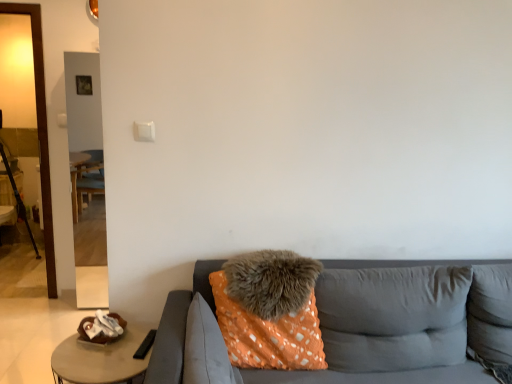
Question: From the image's perspective, would you say orange fabric couch at center is positioned over gray fabric pillow at right, which is counted as the 5th pillow, starting from the left?

Choices:
 (A) no
 (B) yes

Answer: (A)

Question: From a real-world perspective, is orange fabric couch at center under gray fabric pillow at right, the first pillow in the right-to-left sequence?

Choices:
 (A) no
 (B) yes

Answer: (B)

Question: Does orange fabric couch at center have a larger size compared to gray fabric pillow at right, which is counted as the 5th pillow, starting from the left?

Choices:
 (A) no
 (B) yes

Answer: (B)

Question: Is orange fabric couch at center wider than gray fabric pillow at right, which is counted as the 5th pillow, starting from the left?

Choices:
 (A) yes
 (B) no

Answer: (A)

Question: Is orange fabric couch at center not close to gray fabric pillow at right, which is counted as the 5th pillow, starting from the left?

Choices:
 (A) yes
 (B) no

Answer: (A)

Question: Is point (323, 291) closer or farther from the camera than point (245, 316)?

Choices:
 (A) farther
 (B) closer

Answer: (A)

Question: In terms of height, does orange fabric pillow at center, the 4th pillow positioned from the left, look taller or shorter compared to orange fuzzy pillow at center, the 2th pillow when ordered from left to right?

Choices:
 (A) short
 (B) tall

Answer: (A)

Question: In terms of size, does orange fabric pillow at center, the 4th pillow positioned from the left, appear bigger or smaller than orange fuzzy pillow at center, the 2th pillow when ordered from left to right?

Choices:
 (A) big
 (B) small

Answer: (B)

Question: From a real-world perspective, relative to orange fuzzy pillow at center, the 2th pillow when ordered from left to right, is orange fabric pillow at center, the 4th pillow positioned from the left, vertically above or below?

Choices:
 (A) below
 (B) above

Answer: (B)

Question: From the image's perspective, relative to orange fabric couch at center, is orange fuzzy pillow at center, the 2th pillow when ordered from left to right, above or below?

Choices:
 (A) below
 (B) above

Answer: (B)

Question: From a real-world perspective, is orange fuzzy pillow at center, placed as the fourth pillow when sorted from right to left, physically located above or below orange fabric couch at center?

Choices:
 (A) above
 (B) below

Answer: (A)

Question: Is orange fuzzy pillow at center, the 2th pillow when ordered from left to right, inside the boundaries of orange fabric couch at center, or outside?

Choices:
 (A) inside
 (B) outside

Answer: (A)

Question: In terms of width, does orange fuzzy pillow at center, placed as the fourth pillow when sorted from right to left, look wider or thinner when compared to orange fabric couch at center?

Choices:
 (A) thin
 (B) wide

Answer: (A)

Question: Which is correct: orange fabric pillow at center, the 4th pillow positioned from the left, is inside fuzzy gray pillow at center, which is the 3th pillow in right-to-left order, or outside of it?

Choices:
 (A) outside
 (B) inside

Answer: (A)

Question: Looking at the image, does orange fabric pillow at center, the 4th pillow positioned from the left, seem bigger or smaller compared to fuzzy gray pillow at center, which is the 3th pillow in right-to-left order?

Choices:
 (A) small
 (B) big

Answer: (B)